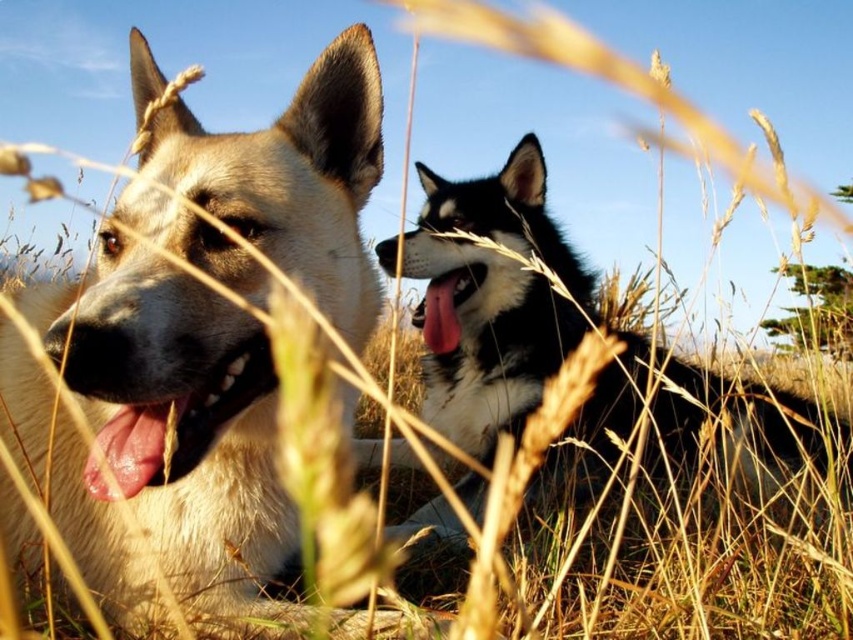
Image resolution: width=853 pixels, height=640 pixels. What do you see at coordinates (178, 419) in the screenshot? I see `golden fur dog at left` at bounding box center [178, 419].

Which is behind, point (136, 554) or point (436, 300)?

The point (436, 300) is behind.

Identify the location of golden fur dog at left. The image size is (853, 640). (178, 419).

Does golden fur dog at left have a greater width compared to black and white fur at center?

Incorrect, golden fur dog at left's width does not surpass black and white fur at center's.

Is golden fur dog at left smaller than black and white fur at center?

Indeed, golden fur dog at left has a smaller size compared to black and white fur at center.

Describe the element at coordinates (178, 419) in the screenshot. I see `golden fur dog at left` at that location.

This screenshot has height=640, width=853. Find the location of `golden fur dog at left`. golden fur dog at left is located at coordinates (178, 419).

Is point (448, 508) positioned in front of point (442, 340)?

Yes.

Consider the image. Can you confirm if black and white fur at center is shorter than pink glossy tongue at center?

No.

Which is in front, point (437, 243) or point (431, 320)?

Point (431, 320) is in front.

Locate an element on the screen. The width and height of the screenshot is (853, 640). black and white fur at center is located at coordinates (496, 300).